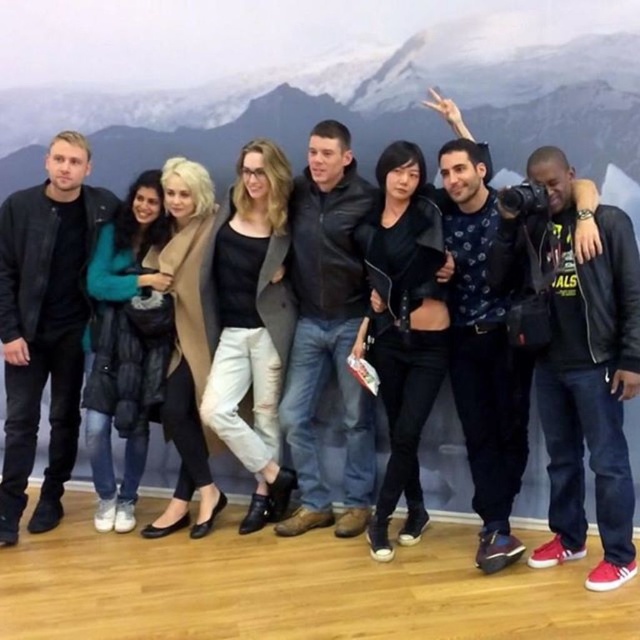
Can you confirm if snowy mountain at upper center is wider than black leather jacket at left?

Yes, snowy mountain at upper center is wider than black leather jacket at left.

Between snowy mountain at upper center and black leather jacket at left, which one is positioned higher?

Positioned higher is snowy mountain at upper center.

Find the location of `snowy mountain at upper center`. snowy mountain at upper center is located at coordinates (330, 83).

The image size is (640, 640). What do you see at coordinates (45, 323) in the screenshot?
I see `black leather jacket at left` at bounding box center [45, 323].

Is black leather jacket at left below black leather jacket at center?

Correct, black leather jacket at left is located below black leather jacket at center.

The height and width of the screenshot is (640, 640). In order to click on black leather jacket at left in this screenshot , I will do `click(45, 323)`.

This screenshot has width=640, height=640. I want to click on black leather jacket at left, so click(45, 323).

How distant is black leather jacket at right from black leather jacket at center?

black leather jacket at right and black leather jacket at center are 38.90 inches apart.

Who is shorter, black leather jacket at right or black leather jacket at center?

black leather jacket at right

Which is behind, point (566, 195) or point (323, 360)?

Point (323, 360)

This screenshot has width=640, height=640. I want to click on black leather jacket at right, so click(x=588, y=381).